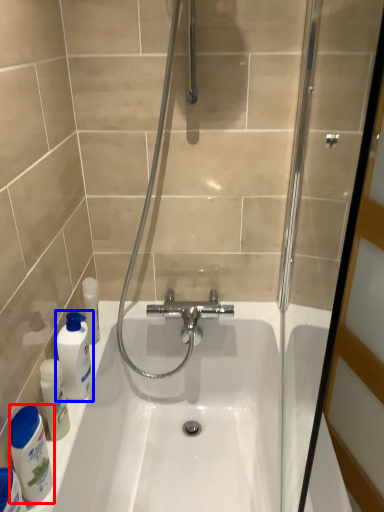
Question: Which of the following is the farthest to the observer, cleaning product (highlighted by a red box) or mouthwash (highlighted by a blue box)?

Choices:
 (A) cleaning product
 (B) mouthwash

Answer: (B)